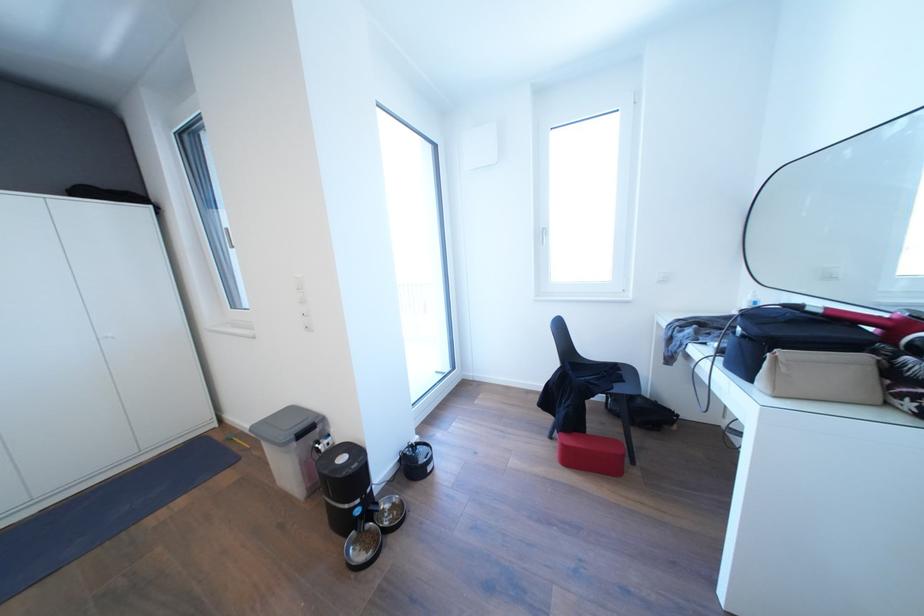
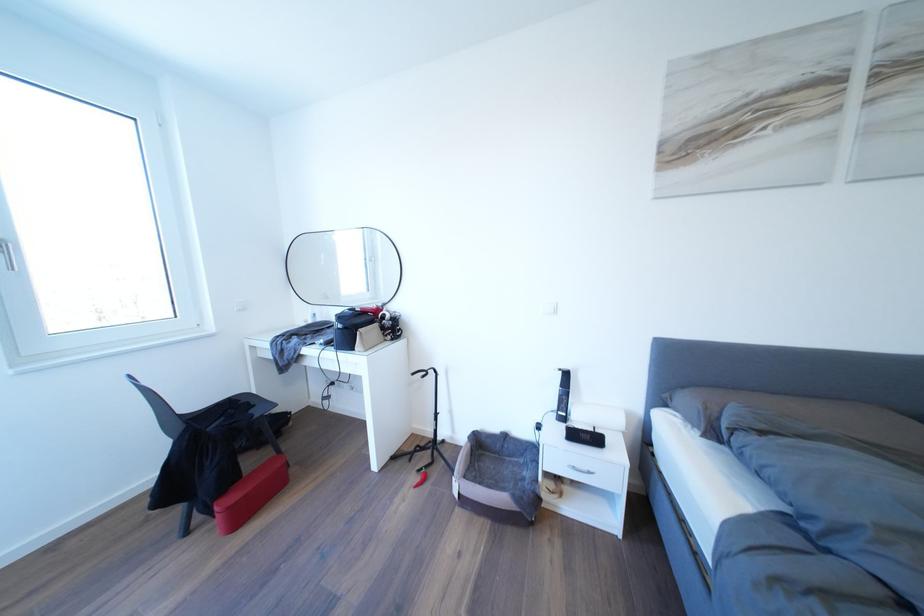
Where in the second image is the point corresponding to point (837, 283) from the first image?

(334, 302)